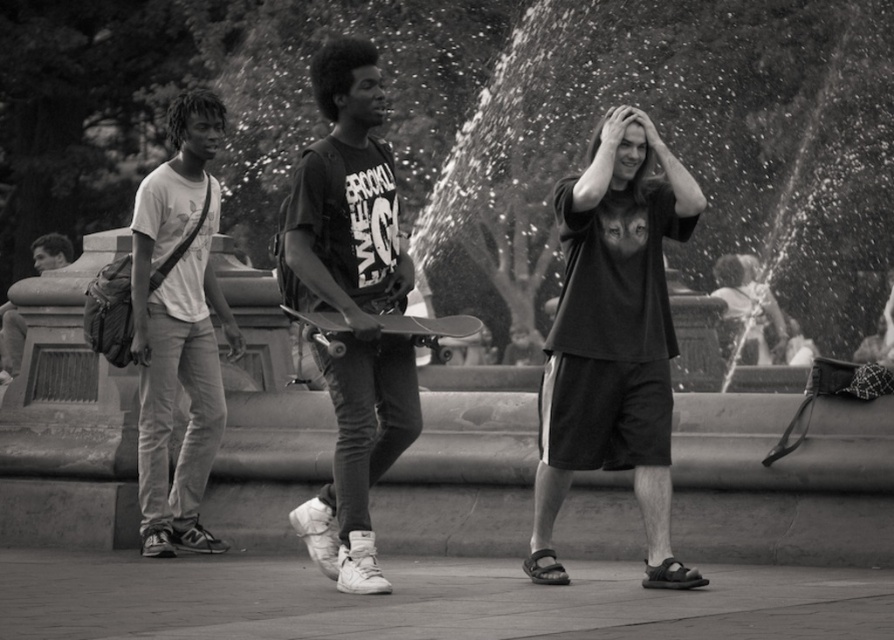
Who is higher up, matte black skateboard at center or smooth black skateboard at center?

matte black skateboard at center is higher up.

Is matte black skateboard at center thinner than smooth black skateboard at center?

Yes.

The image size is (894, 640). Find the location of `matte black skateboard at center`. matte black skateboard at center is located at coordinates (351, 305).

Is point (137, 317) positioned in front of point (450, 332)?

That is False.

Between point (187, 198) and point (452, 321), which one is positioned behind?

Point (187, 198)

Where is `light gray cotton pants at left`? light gray cotton pants at left is located at coordinates (178, 330).

Is point (299, 301) positioned before point (153, 218)?

Yes, it is.

Is matte black skateboard at center below light gray cotton pants at left?

Actually, matte black skateboard at center is above light gray cotton pants at left.

This screenshot has height=640, width=894. What are the coordinates of `matte black skateboard at center` in the screenshot? It's located at (351, 305).

This screenshot has height=640, width=894. What are the coordinates of `matte black skateboard at center` in the screenshot? It's located at (351, 305).